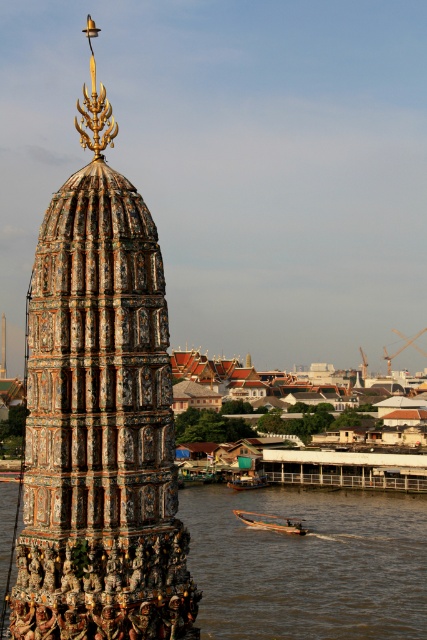
You are standing on the riverside and see the multicolored mosaic tower at center and the brown water at lower center. Which object is positioned to the left when viewed from your perspective?

The multicolored mosaic tower at center is to the left of the brown water at lower center from your perspective.

You are an architect visiting the site and need to determine the relative sizes of the multicolored mosaic tower at center and the brown water at lower center. Based on the scene, which one is larger?

The multicolored mosaic tower at center is bigger than the brown water at lower center according to the description.